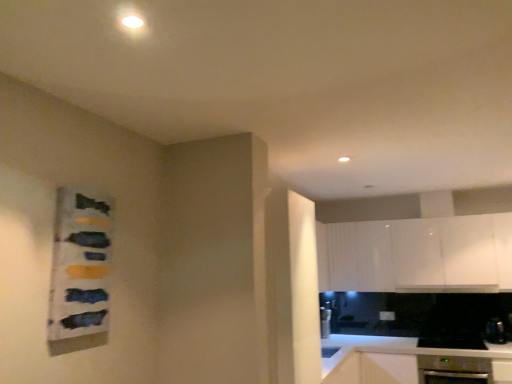
Question: Does white glossy countertop at lower right appear on the right side of black stainless steel oven at lower right, which ranks as the 1th appliance in left-to-right order?

Choices:
 (A) no
 (B) yes

Answer: (A)

Question: Does white glossy countertop at lower right lie in front of black stainless steel oven at lower right, which ranks as the 1th appliance in left-to-right order?

Choices:
 (A) yes
 (B) no

Answer: (A)

Question: Considering the relative sizes of white glossy countertop at lower right and black stainless steel oven at lower right, which ranks as the 1th appliance in left-to-right order, in the image provided, is white glossy countertop at lower right wider than black stainless steel oven at lower right, which ranks as the 1th appliance in left-to-right order,?

Choices:
 (A) yes
 (B) no

Answer: (A)

Question: Is white glossy countertop at lower right positioned with its back to black stainless steel oven at lower right, which ranks as the 1th appliance in left-to-right order?

Choices:
 (A) yes
 (B) no

Answer: (B)

Question: From the image's perspective, is white glossy countertop at lower right on black stainless steel oven at lower right, which is the 2th appliance in right-to-left order?

Choices:
 (A) yes
 (B) no

Answer: (B)

Question: Is white glossy countertop at lower right at the left side of black stainless steel oven at lower right, which is the 2th appliance in right-to-left order?

Choices:
 (A) no
 (B) yes

Answer: (B)

Question: Is satin black oven at lower right, which ranks as the second appliance in left-to-right order, inside white glossy cabinet at upper right?

Choices:
 (A) yes
 (B) no

Answer: (B)

Question: Is white glossy cabinet at upper right to the left of satin black oven at lower right, the 1th appliance in the right-to-left sequence, from the viewer's perspective?

Choices:
 (A) yes
 (B) no

Answer: (A)

Question: Is the depth of white glossy cabinet at upper right less than that of satin black oven at lower right, the 1th appliance in the right-to-left sequence?

Choices:
 (A) yes
 (B) no

Answer: (A)

Question: Considering the relative sizes of white glossy cabinet at upper right and satin black oven at lower right, the 1th appliance in the right-to-left sequence, in the image provided, is white glossy cabinet at upper right taller than satin black oven at lower right, the 1th appliance in the right-to-left sequence,?

Choices:
 (A) no
 (B) yes

Answer: (B)

Question: Is white glossy cabinet at upper right behind satin black oven at lower right, the 1th appliance in the right-to-left sequence?

Choices:
 (A) no
 (B) yes

Answer: (A)

Question: From a real-world perspective, is white glossy cabinet at upper right positioned under satin black oven at lower right, which ranks as the second appliance in left-to-right order, based on gravity?

Choices:
 (A) no
 (B) yes

Answer: (A)

Question: Is white glossy countertop at lower right behind satin black oven at lower right, which ranks as the second appliance in left-to-right order?

Choices:
 (A) yes
 (B) no

Answer: (B)